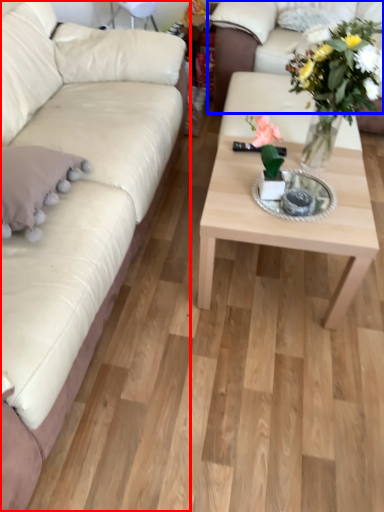
Question: Which point is closer to the camera, studio couch (highlighted by a red box) or studio couch (highlighted by a blue box)?

Choices:
 (A) studio couch
 (B) studio couch

Answer: (A)